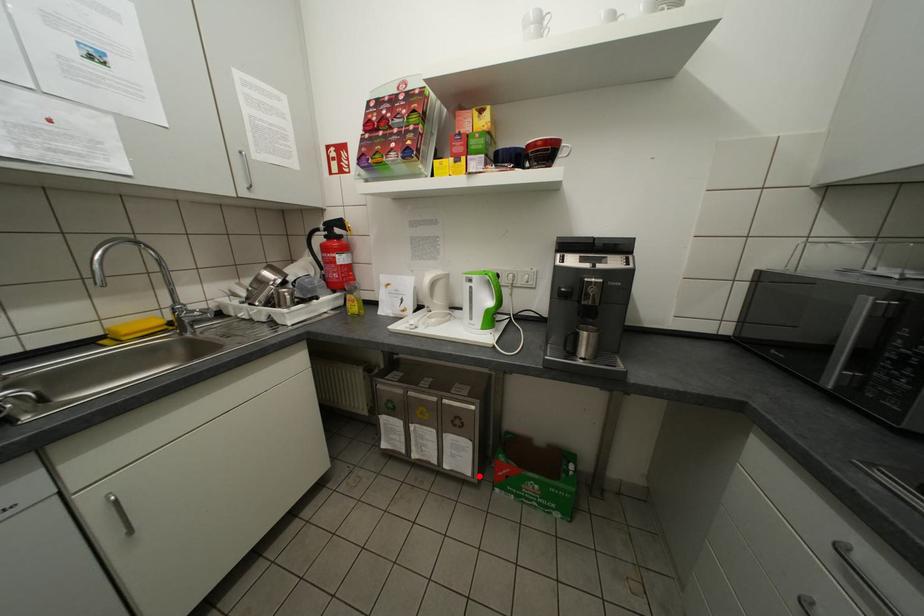
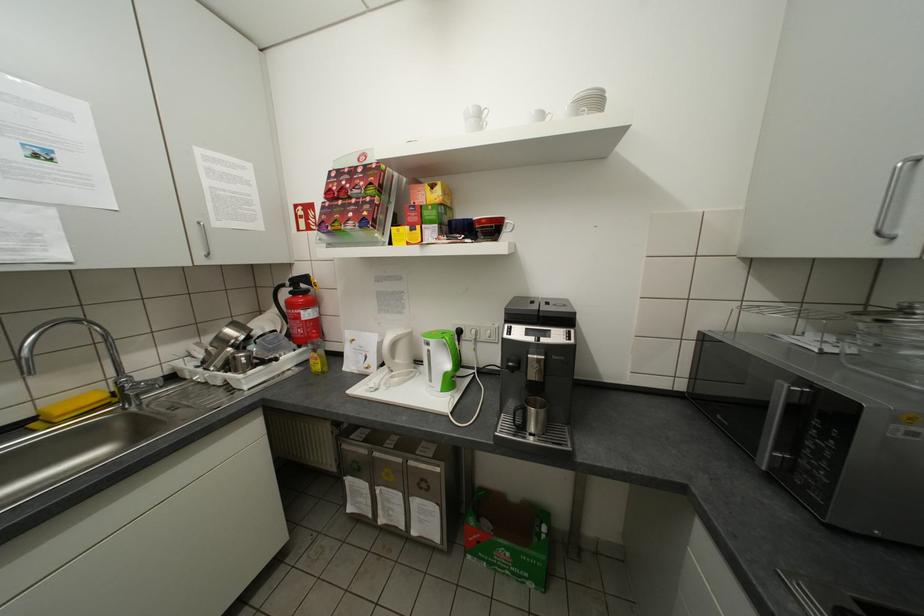
Where in the second image is the point corresponding to the highlighted location from the first image?

(448, 543)